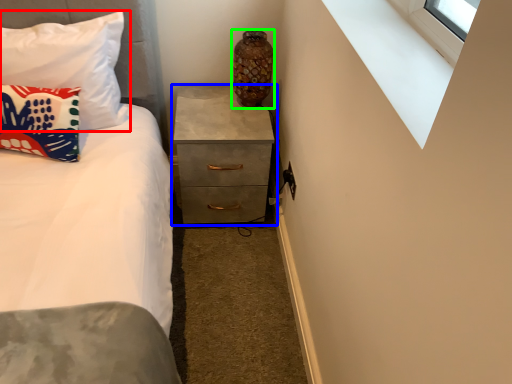
Question: Considering the real-world distances, which object is farthest from pillow (highlighted by a red box)? chest of drawers (highlighted by a blue box) or vase (highlighted by a green box)?

Choices:
 (A) chest of drawers
 (B) vase

Answer: (B)